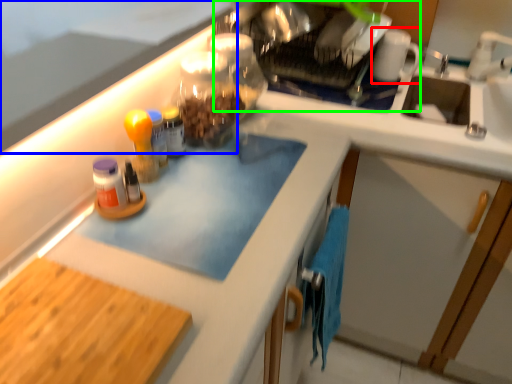
Question: Estimate the real-world distances between objects in this image. Which object is farther from mug (highlighted by a red box), countertop (highlighted by a blue box) or appliance (highlighted by a green box)?

Choices:
 (A) countertop
 (B) appliance

Answer: (A)